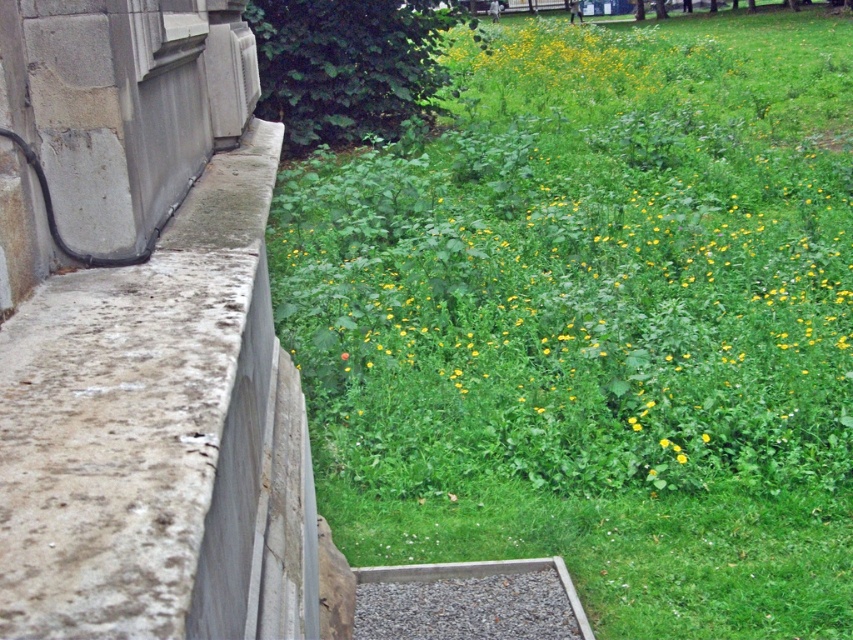
Question: Which point is closer to the camera?

Choices:
 (A) green leafy grass at upper right
 (B) concrete ledge at left
 (C) gray gravel at bottom
 (D) yellow matte flower at center

Answer: (B)

Question: Observing the image, what is the correct spatial positioning of green leafy grass at upper right in reference to gray gravel at bottom?

Choices:
 (A) below
 (B) above

Answer: (B)

Question: Which object appears farthest from the camera in this image?

Choices:
 (A) gray gravel at bottom
 (B) concrete ledge at left

Answer: (A)

Question: Is concrete ledge at left smaller than yellow matte flower at center?

Choices:
 (A) yes
 (B) no

Answer: (B)

Question: Is concrete ledge at left smaller than gray gravel at bottom?

Choices:
 (A) yes
 (B) no

Answer: (B)

Question: Which point is farther to the camera?

Choices:
 (A) green leafy grass at upper right
 (B) concrete ledge at left

Answer: (A)